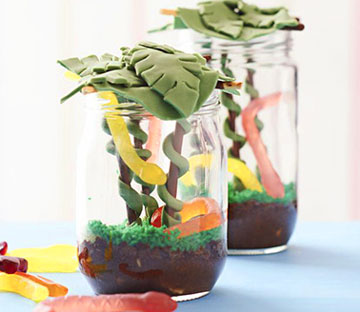
Where is `jar on the foreground`? This screenshot has width=360, height=312. jar on the foreground is located at coordinates (173, 268).